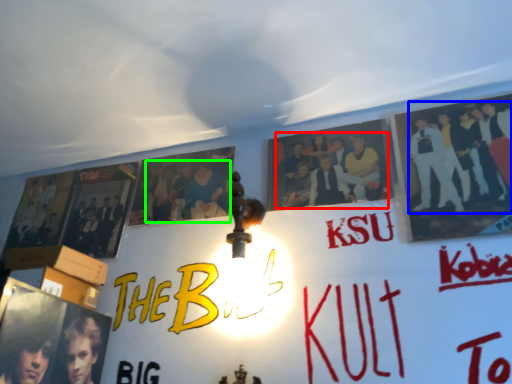
Question: Estimate the real-world distances between objects in this image. Which object is farther from person (highlighted by a red box), person (highlighted by a blue box) or person (highlighted by a green box)?

Choices:
 (A) person
 (B) person

Answer: (B)